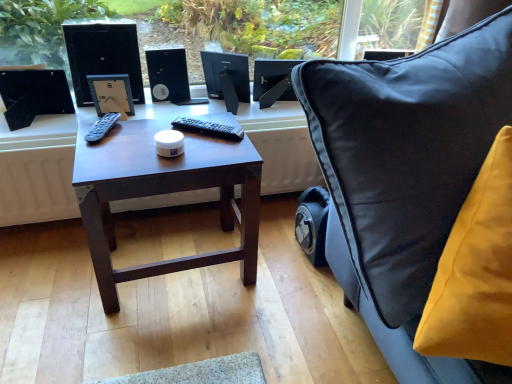
Locate an element on the screen. This screenshot has height=384, width=512. vacant area in front of dark wood table at center is located at coordinates (161, 340).